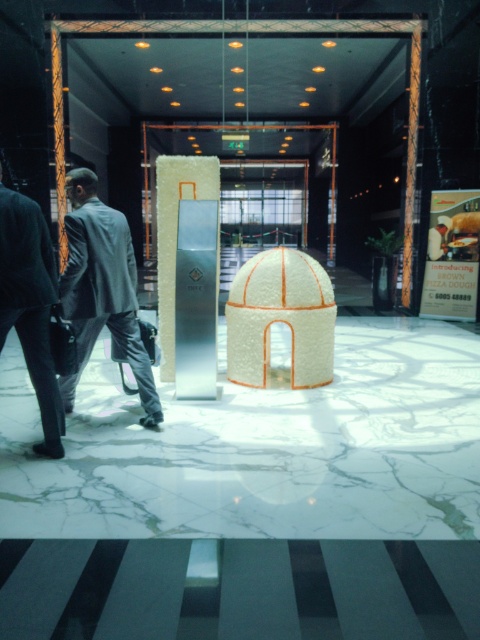
Which of these two, silver metallic pillar at center or dark gray suit at left, stands shorter?

Standing shorter between the two is dark gray suit at left.

The image size is (480, 640). What do you see at coordinates (188, 273) in the screenshot?
I see `silver metallic pillar at center` at bounding box center [188, 273].

I want to click on silver metallic pillar at center, so click(x=188, y=273).

The height and width of the screenshot is (640, 480). I want to click on silver metallic pillar at center, so click(x=188, y=273).

Which is in front, point (195, 308) or point (111, 275)?

Point (111, 275) is in front.

Which is below, silver metallic pillar at center or gray suit at left?

gray suit at left

Is point (202, 387) positioned behind point (68, 320)?

Yes.

You are a GUI agent. You are given a task and a screenshot of the screen. Output one action in this format:
    pyautogui.click(x=<x>, y=<y>)
    Task: Click on the silver metallic pillar at center
    The height and width of the screenshot is (640, 480).
    Given the screenshot: What is the action you would take?
    pyautogui.click(x=188, y=273)

Who is more distant from viewer, (70, 172) or (21, 211)?

The point (70, 172) is behind.

Is point (79, 230) behind point (1, 348)?

Yes, it is behind point (1, 348).

In order to click on gray suit at left in this screenshot , I will do `click(101, 289)`.